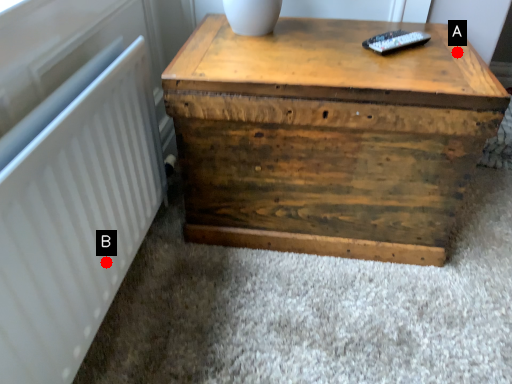
Question: Two points are circled on the image, labeled by A and B beside each circle. Which point is further to the camera?

Choices:
 (A) A is further
 (B) B is further

Answer: (A)